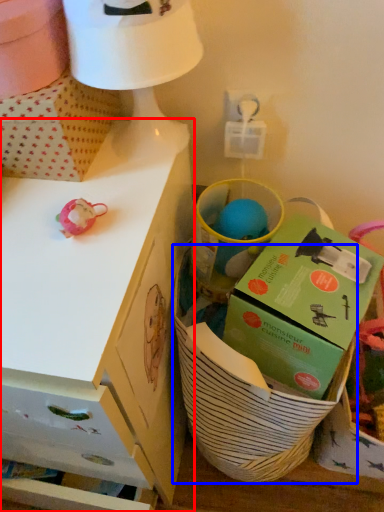
Question: Which of the following is the farthest to the observer, desk (highlighted by a red box) or basket (highlighted by a blue box)?

Choices:
 (A) desk
 (B) basket

Answer: (B)